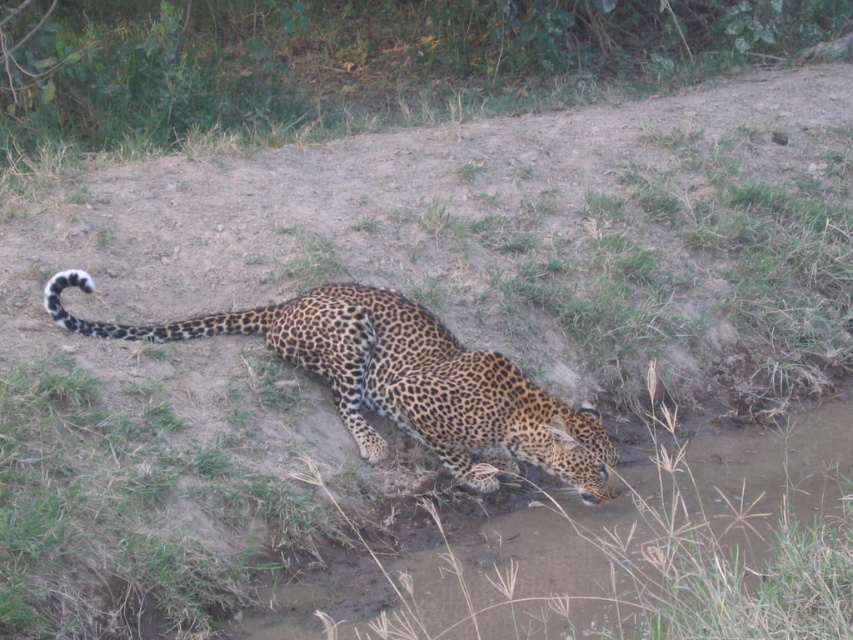
Question: Is spotted fur cheetah at lower center further to camera compared to spotted fur tail at lower center?

Choices:
 (A) yes
 (B) no

Answer: (B)

Question: From the image, what is the correct spatial relationship of spotted fur cheetah at lower center in relation to spotted fur tail at lower center?

Choices:
 (A) below
 (B) above

Answer: (A)

Question: Does spotted fur cheetah at lower center have a smaller size compared to spotted fur tail at lower center?

Choices:
 (A) yes
 (B) no

Answer: (B)